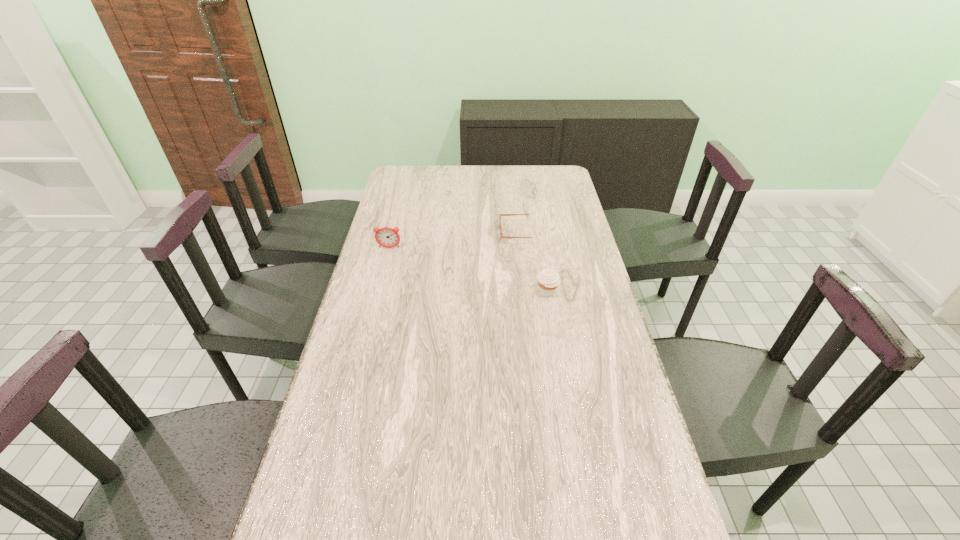
Find the location of a particular element. Image resolution: width=960 pixels, height=540 pixels. the nearest object is located at coordinates (548, 280).

Locate an element on the screen. the second farthest object is located at coordinates (387, 237).

Find the location of `the leftmost object`. the leftmost object is located at coordinates (387, 237).

I want to click on the farthest object, so click(x=500, y=215).

Find the location of a particular element. The image size is (960, 540). sunglasses is located at coordinates (500, 215).

What are the coordinates of `free region located on the right of the muffin` in the screenshot? It's located at (594, 292).

Locate an element on the screen. free region located 0.400m on the front-facing side of the second nearest object is located at coordinates click(369, 329).

Where is `blank space located on the front-facing side of the shortest object`? blank space located on the front-facing side of the shortest object is located at coordinates (416, 233).

At what (x,y) coordinates should I click in order to perform the action: click on free space located on the front-facing side of the shortest object. Please return your answer as a coordinate pair (x, y). The width and height of the screenshot is (960, 540). Looking at the image, I should click on (456, 233).

Find the location of `vacant region located 0.260m on the front-facing side of the shortest object`. vacant region located 0.260m on the front-facing side of the shortest object is located at coordinates (433, 233).